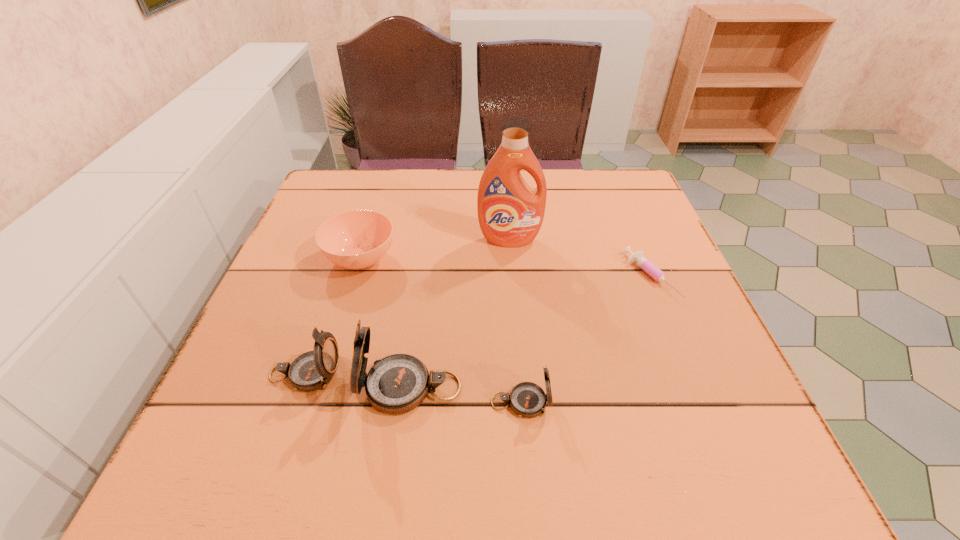
This screenshot has width=960, height=540. I want to click on free region that satisfies the following two spatial constraints: 1. on the front-facing side of the detergent; 2. on the face of the tallest compass, so click(x=521, y=388).

Find the location of `vacant point that satisfies the following two spatial constraints: 1. on the front-facing side of the tallest object; 2. on the face of the leftmost compass`. vacant point that satisfies the following two spatial constraints: 1. on the front-facing side of the tallest object; 2. on the face of the leftmost compass is located at coordinates (520, 374).

Identify the location of vacant position in the image that satisfies the following two spatial constraints: 1. on the front-facing side of the tallest object; 2. on the face of the rightmost compass. The height and width of the screenshot is (540, 960). click(x=522, y=402).

Identify the location of free spot that satisfies the following two spatial constraints: 1. on the front side of the syringe; 2. on the right side of the soup bowl. (356, 276).

Where is `free location that satisfies the following two spatial constraints: 1. on the front-facing side of the detergent; 2. on the face of the second compass from left to right`? free location that satisfies the following two spatial constraints: 1. on the front-facing side of the detergent; 2. on the face of the second compass from left to right is located at coordinates (521, 388).